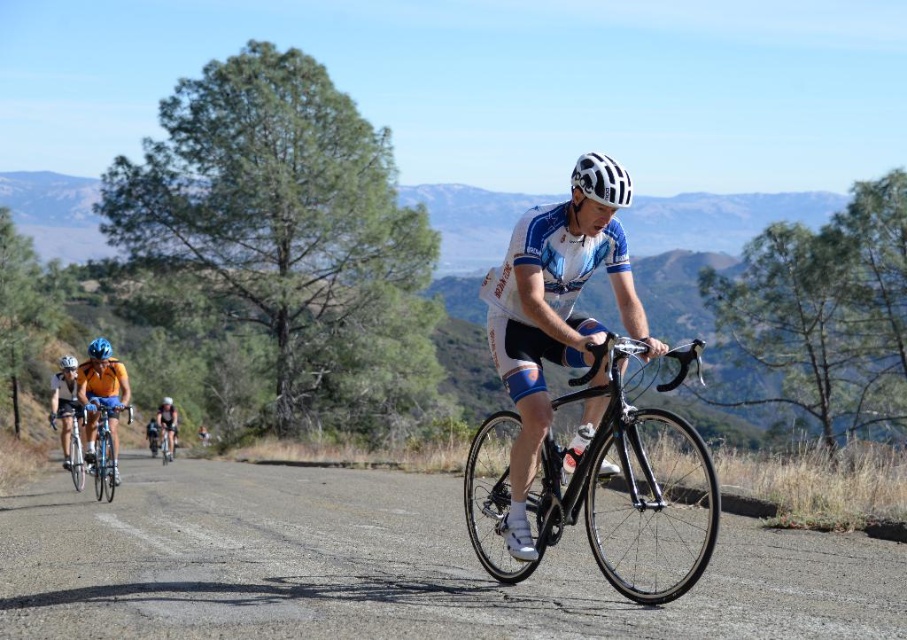
You are a photographer positioned at the side of the road. You want to capture both the black glossy road bike at center and the shiny blue bicycle at center in a single frame. Which bike should you adjust your camera angle to include first if you need to ensure both are fully visible?

The black glossy road bike at center is wider than the shiny blue bicycle at center, so you should adjust your camera angle to include the black glossy road bike at center first to ensure both bikes fit in the frame.

You are a photographer trying to capture a closeup of the black glossy road bike at center and the orange jersey cyclist at left. Since you want to focus on the bike, which object should you zoom in on first and why?

The black glossy road bike at center is bigger than the orange jersey cyclist at left, so you should zoom in on the black glossy road bike at center first because it is larger and closer to the camera.